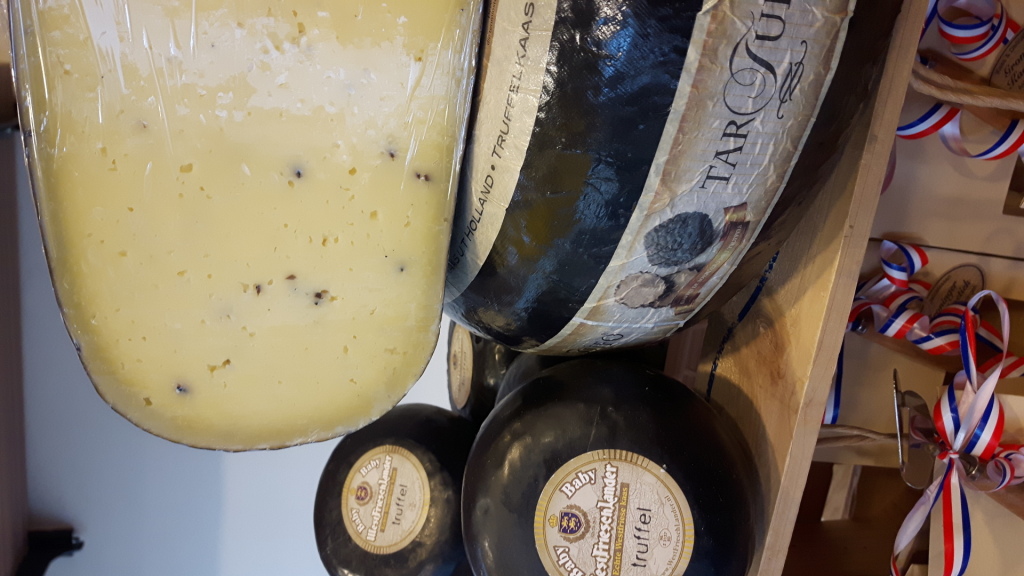
I want to click on bracket under shelf, so click(61, 22).